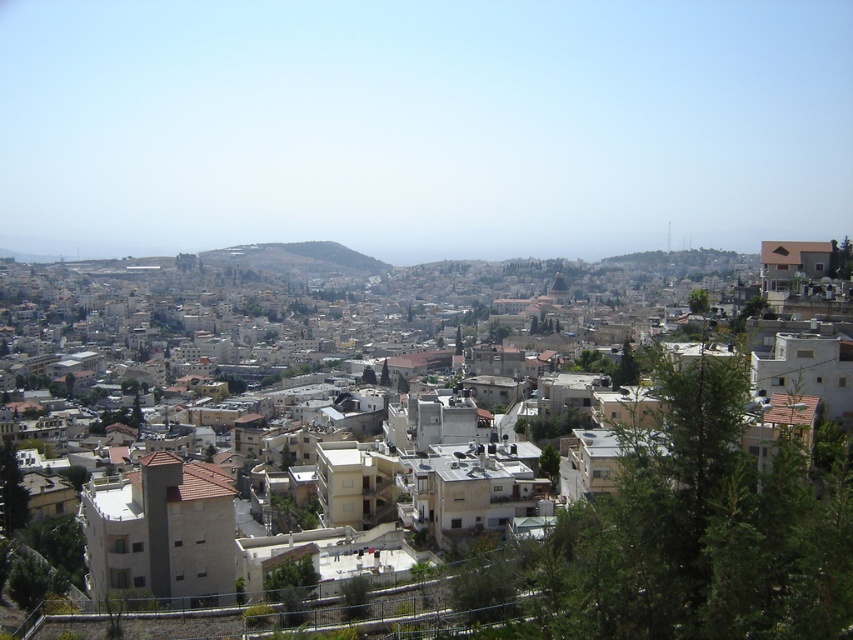
Does beige stone buildings at center have a larger size compared to green grassy hillside at center?

Correct, beige stone buildings at center is larger in size than green grassy hillside at center.

The width and height of the screenshot is (853, 640). I want to click on beige stone buildings at center, so click(317, 300).